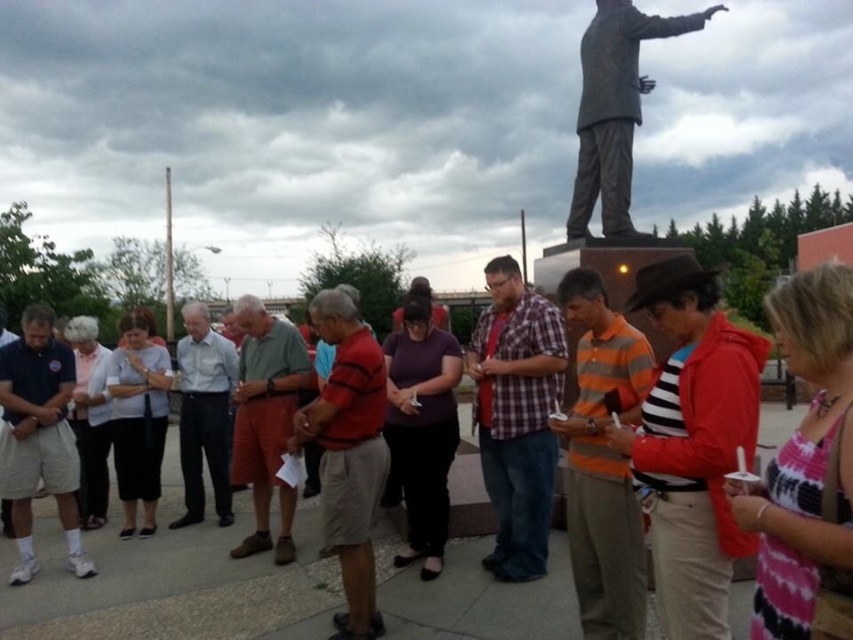
You are a photographer standing at the edge of the group. You want to take a photo that includes both the striped cotton shirt at center and the white cotton shorts at left. If your camera has a maximum focus range of 12 feet, will you be able to capture both subjects in focus without moving closer?

The striped cotton shirt at center is 13.28 feet from the white cotton shorts at left. Since the distance between them exceeds the camera maximum focus range of 12 feet, the camera might not be able to keep both in focus simultaneously without adjusting the focus point or moving closer.

You are a photographer taking a picture of the striped cotton shirt at center and the white cotton shorts at left. Based on their positions, which clothing item will appear larger in the photo?

The striped cotton shirt at center is positioned over the white cotton shorts at left, so it will appear larger in the photo due to its closer proximity to the camera.

You are standing at the location of point (337, 305) and want to walk towards the statue. Is point (581, 346) in your path?

Yes, point (581, 346) is in your path because it is in front of point (337, 305), which is your current location.